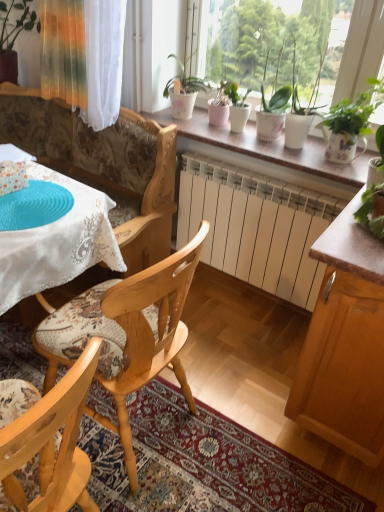
Where is `free spot above blue textured paper plate at upper left (from a real-world perspective)`? Image resolution: width=384 pixels, height=512 pixels. free spot above blue textured paper plate at upper left (from a real-world perspective) is located at coordinates click(x=34, y=194).